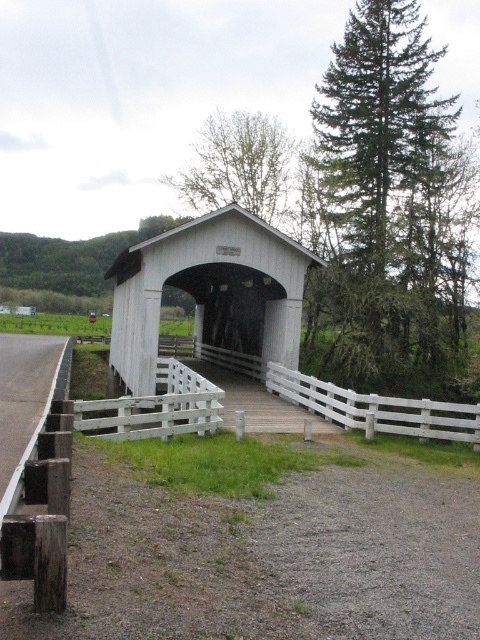
Question: Is white wooden bridge at center positioned behind smooth asphalt road at lower left?

Choices:
 (A) yes
 (B) no

Answer: (A)

Question: Which of the following is the farthest from the observer?

Choices:
 (A) (17, 467)
 (B) (227, 317)

Answer: (B)

Question: Is white wooden bridge at center positioned at the back of smooth asphalt road at lower left?

Choices:
 (A) yes
 (B) no

Answer: (A)

Question: Does white wooden bridge at center appear on the left side of smooth asphalt road at lower left?

Choices:
 (A) yes
 (B) no

Answer: (B)

Question: Which point is closer to the camera?

Choices:
 (A) smooth asphalt road at lower left
 (B) white wooden bridge at center

Answer: (A)